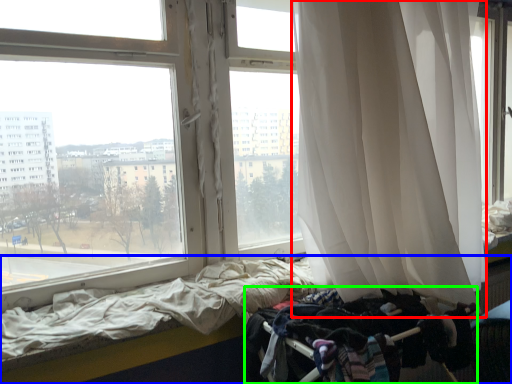
Question: Estimate the real-world distances between objects in this image. Which object is closer to curtain (highlighted by a red box), bed (highlighted by a blue box) or baby carriage (highlighted by a green box)?

Choices:
 (A) bed
 (B) baby carriage

Answer: (B)